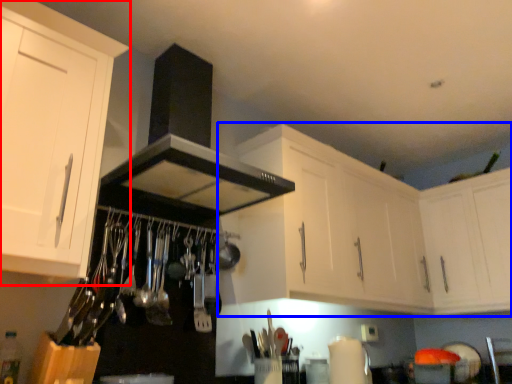
Question: Which object appears closest to the camera in this image, cabinetry (highlighted by a red box) or cabinetry (highlighted by a blue box)?

Choices:
 (A) cabinetry
 (B) cabinetry

Answer: (A)